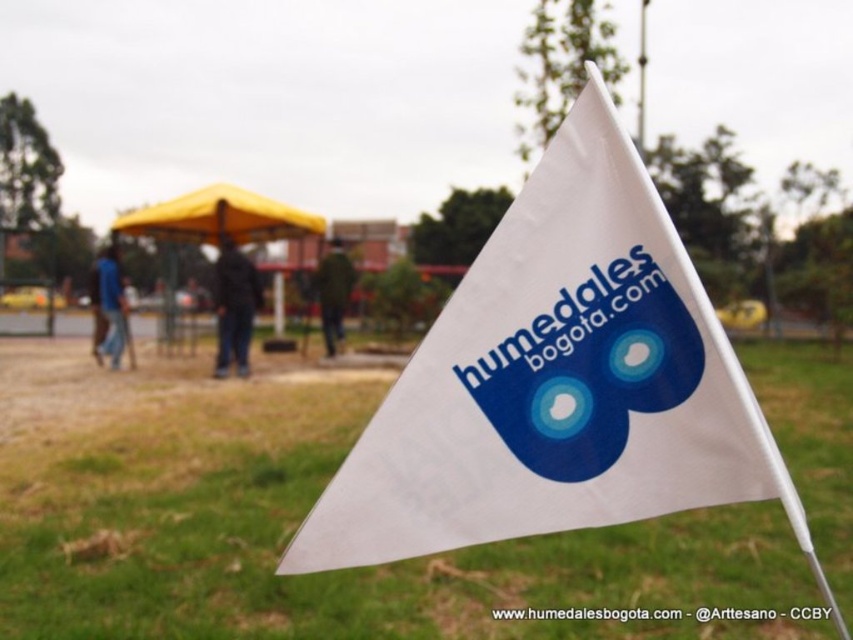
Question: Is the position of green grass at center less distant than that of white plastic pole at upper center?

Choices:
 (A) no
 (B) yes

Answer: (B)

Question: Which object appears farthest from the camera in this image?

Choices:
 (A) white fabric flag at center
 (B) green grass at center
 (C) white plastic pole at upper center
 (D) yellow fabric canopy at upper left

Answer: (D)

Question: Observing the image, what is the correct spatial positioning of green grass at center in reference to white plastic pole at upper center?

Choices:
 (A) right
 (B) left

Answer: (B)

Question: Can you confirm if green grass at center is positioned above white plastic pole at upper center?

Choices:
 (A) no
 (B) yes

Answer: (A)

Question: Considering the real-world distances, which object is farthest from the yellow fabric canopy at upper left?

Choices:
 (A) green grass at center
 (B) white plastic pole at upper center
 (C) white fabric flag at center

Answer: (C)

Question: Considering the real-world distances, which object is closest to the white fabric flag at center?

Choices:
 (A) green grass at center
 (B) white plastic pole at upper center

Answer: (A)